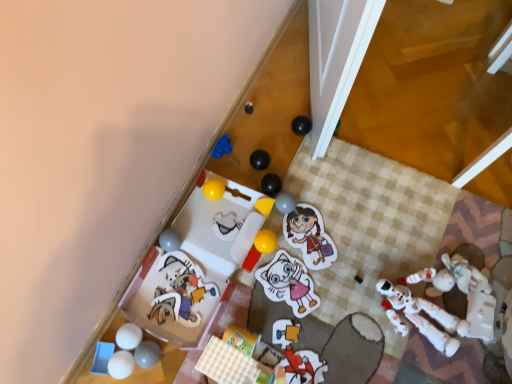
The image size is (512, 384). I want to click on free space to the right of matte gray ball at lower left, which is counted as the twelfth toy, starting from the right, so click(201, 348).